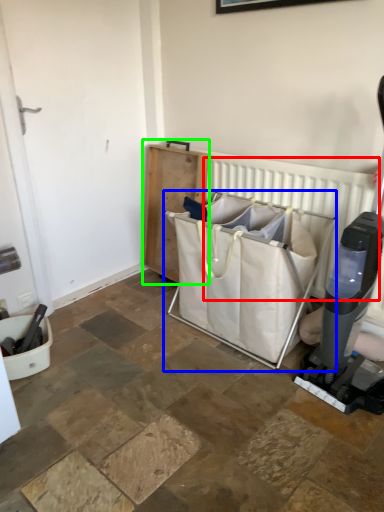
Question: Which object is the closest to the radiator (highlighted by a red box)? Choose among these: baby carriage (highlighted by a blue box) or furniture (highlighted by a green box).

Choices:
 (A) baby carriage
 (B) furniture

Answer: (A)